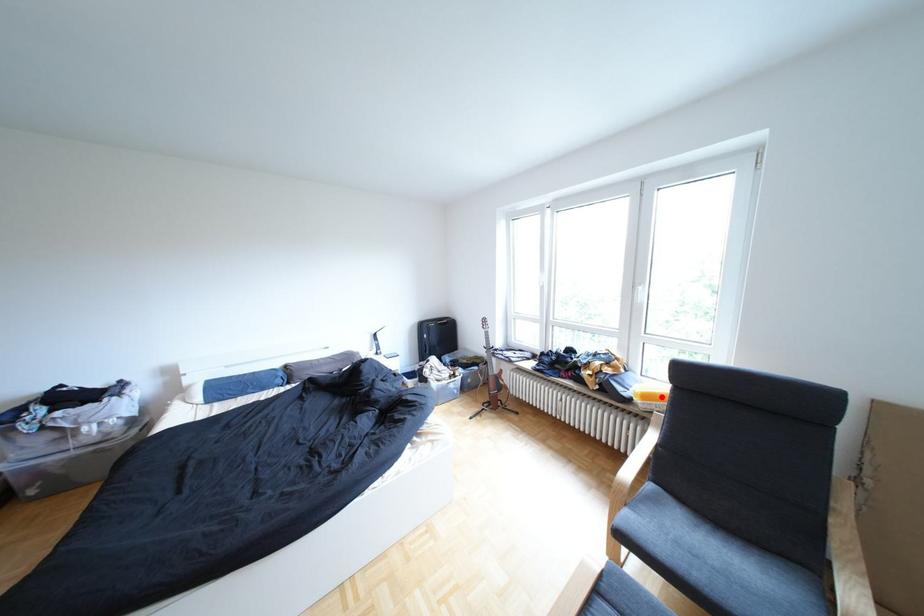
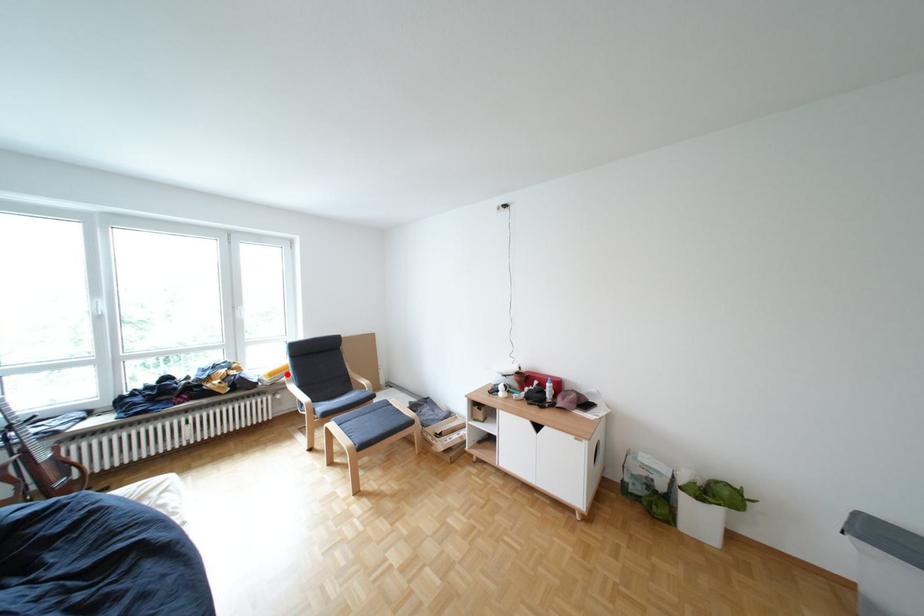
I am providing you with two images of the same scene from different viewpoints. A red point is marked on the first image and another point is marked on the second image. Do the highlighted points in image1 and image2 indicate the same real-world spot?

Yes